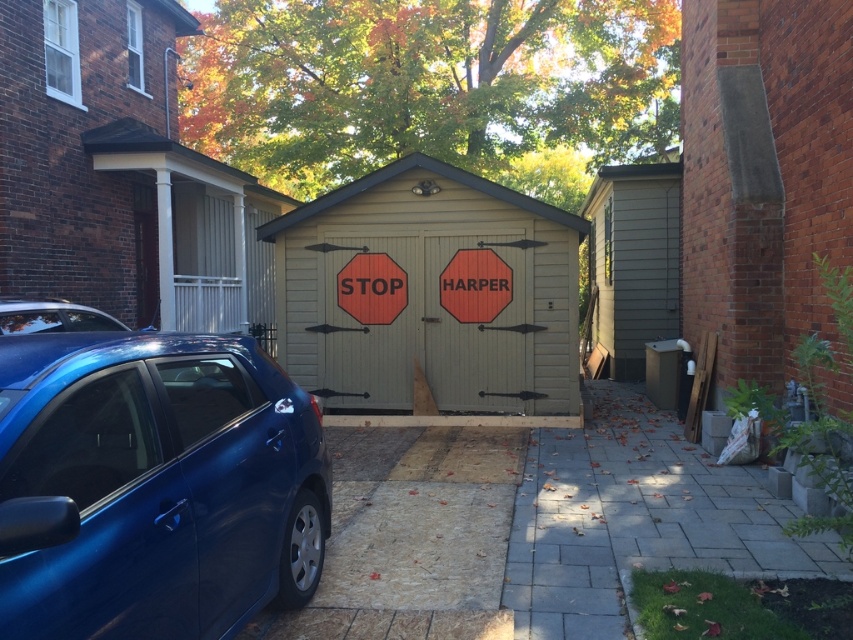
Question: Which of the following is the closest to the observer?

Choices:
 (A) smooth concrete driveway at center
 (B) green siding at center
 (C) matte wood stop sign at center
 (D) glossy blue car at lower left

Answer: (D)

Question: Which object appears closest to the camera in this image?

Choices:
 (A) glossy blue car at lower left
 (B) green siding at center

Answer: (A)

Question: Does green siding at center appear over matte wood stop sign at center?

Choices:
 (A) no
 (B) yes

Answer: (B)

Question: Is smooth concrete driveway at center to the left of matte wood stop sign at center from the viewer's perspective?

Choices:
 (A) no
 (B) yes

Answer: (A)

Question: Which point is closer to the camera?

Choices:
 (A) (247, 467)
 (B) (498, 266)
 (C) (358, 307)
 (D) (606, 324)

Answer: (A)

Question: Is glossy blue car at lower left to the right of matte wood stop sign at center from the viewer's perspective?

Choices:
 (A) no
 (B) yes

Answer: (A)